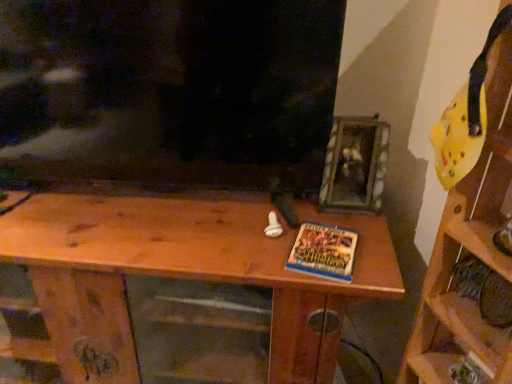
Question: Is wooden table at center, which is counted as the first shelf, starting from the left, further to the viewer compared to blue glossy book at center?

Choices:
 (A) yes
 (B) no

Answer: (B)

Question: Is wooden table at center, which is counted as the first shelf, starting from the left, to the right of blue glossy book at center from the viewer's perspective?

Choices:
 (A) no
 (B) yes

Answer: (A)

Question: From a real-world perspective, is wooden table at center, which is counted as the first shelf, starting from the left, on blue glossy book at center?

Choices:
 (A) no
 (B) yes

Answer: (A)

Question: Is blue glossy book at center at the back of wooden table at center, which is counted as the first shelf, starting from the left?

Choices:
 (A) yes
 (B) no

Answer: (B)

Question: Does wooden table at center, the 2th shelf positioned from the right, have a greater height compared to blue glossy book at center?

Choices:
 (A) no
 (B) yes

Answer: (B)

Question: In terms of width, does wooden table at center, the 2th shelf positioned from the right, look wider or thinner when compared to yellow foam helmet at upper right, placed as the second shelf when sorted from left to right?

Choices:
 (A) thin
 (B) wide

Answer: (B)

Question: Is wooden table at center, the 2th shelf positioned from the right, taller or shorter than yellow foam helmet at upper right, which is the first shelf from right to left?

Choices:
 (A) tall
 (B) short

Answer: (B)

Question: From the image's perspective, is wooden table at center, the 2th shelf positioned from the right, above or below yellow foam helmet at upper right, placed as the second shelf when sorted from left to right?

Choices:
 (A) below
 (B) above

Answer: (A)

Question: Does point click(x=94, y=281) appear closer or farther from the camera than point click(x=495, y=82)?

Choices:
 (A) farther
 (B) closer

Answer: (A)

Question: Is point (74, 360) positioned closer to the camera than point (321, 238)?

Choices:
 (A) closer
 (B) farther

Answer: (B)

Question: Based on their sizes in the image, would you say wooden table at center, which is counted as the first shelf, starting from the left, is bigger or smaller than blue glossy book at center?

Choices:
 (A) small
 (B) big

Answer: (B)

Question: Would you say wooden table at center, the 2th shelf positioned from the right, is inside or outside blue glossy book at center?

Choices:
 (A) outside
 (B) inside

Answer: (A)

Question: Considering the relative positions of wooden table at center, the 2th shelf positioned from the right, and blue glossy book at center in the image provided, is wooden table at center, the 2th shelf positioned from the right, to the left or to the right of blue glossy book at center?

Choices:
 (A) left
 (B) right

Answer: (A)

Question: Which is correct: blue glossy book at center is inside yellow foam helmet at upper right, placed as the second shelf when sorted from left to right, or outside of it?

Choices:
 (A) inside
 (B) outside

Answer: (B)

Question: From the image's perspective, relative to yellow foam helmet at upper right, which is the first shelf from right to left, is blue glossy book at center above or below?

Choices:
 (A) below
 (B) above

Answer: (B)